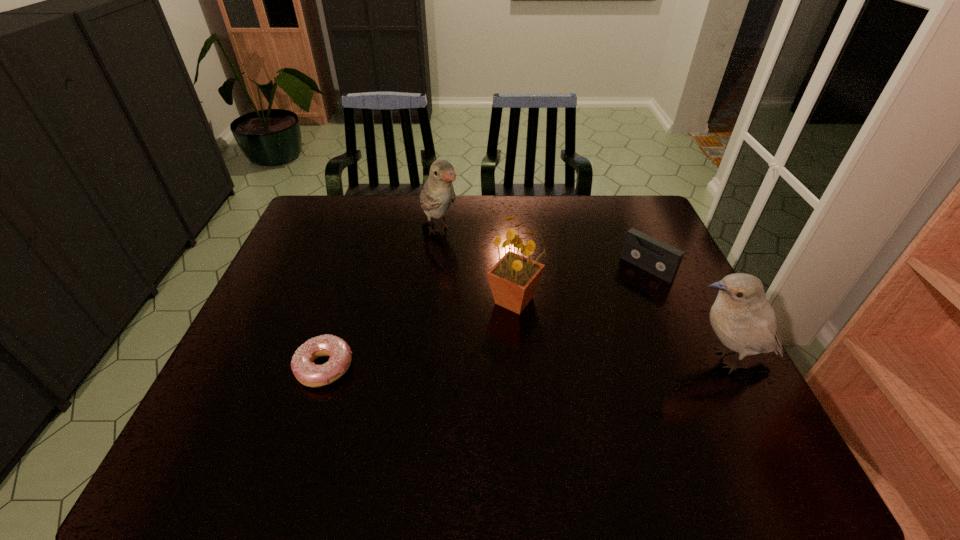
Locate an element on the screen. Image resolution: width=960 pixels, height=540 pixels. free point between the third object from left to right and the videotape is located at coordinates (581, 285).

Identify the location of vacant space in between the left bird and the leftmost object. This screenshot has height=540, width=960. (382, 299).

Locate an element on the screen. free area in between the left bird and the leftmost object is located at coordinates (382, 299).

The width and height of the screenshot is (960, 540). I want to click on object that ranks as the closest to the doughnut, so click(514, 278).

Identify the location of object that stands as the fourth closest to the shortest object. This screenshot has width=960, height=540. (742, 318).

Find the location of `vacant area in the image that satisfies the following two spatial constraints: 1. on the front side of the second object from left to right; 2. at the beak of the nearer bird`. vacant area in the image that satisfies the following two spatial constraints: 1. on the front side of the second object from left to right; 2. at the beak of the nearer bird is located at coordinates (423, 360).

Identify the location of free space that satisfies the following two spatial constraints: 1. on the back side of the shortest object; 2. on the right side of the farthest object. This screenshot has width=960, height=540. (368, 231).